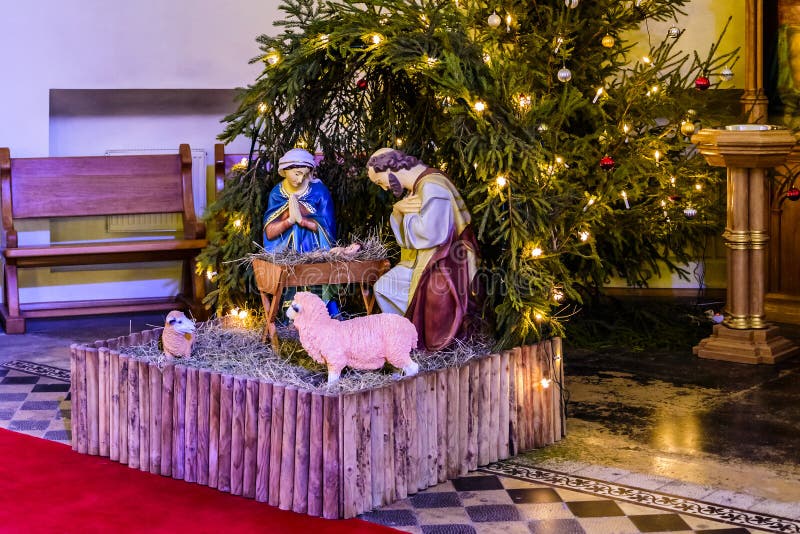
Find the location of a particular element. This screenshot has width=800, height=534. lighted christmas nativity is located at coordinates (164, 334), (329, 353), (320, 264), (414, 256), (278, 216).